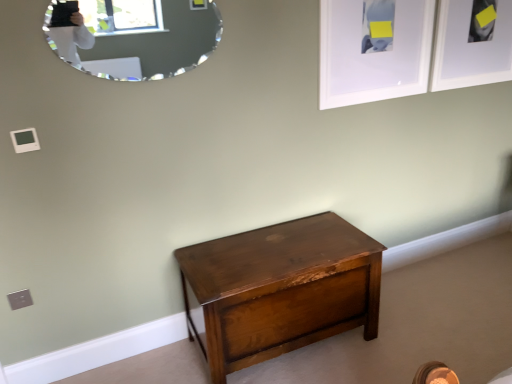
Question: Is white matte picture frame at upper right, the 1th picture frame positioned from the left, facing towards white matte picture frame at upper right, which appears as the 2th picture frame when viewed from the left?

Choices:
 (A) yes
 (B) no

Answer: (B)

Question: Can you confirm if white matte picture frame at upper right, the second picture frame when ordered from right to left, is positioned to the right of white matte picture frame at upper right, positioned as the first picture frame in right-to-left order?

Choices:
 (A) yes
 (B) no

Answer: (B)

Question: From a real-world perspective, is white matte picture frame at upper right, the second picture frame when ordered from right to left, over white matte picture frame at upper right, which appears as the 2th picture frame when viewed from the left?

Choices:
 (A) no
 (B) yes

Answer: (B)

Question: Is white matte picture frame at upper right, the second picture frame when ordered from right to left, thinner than white matte picture frame at upper right, which appears as the 2th picture frame when viewed from the left?

Choices:
 (A) yes
 (B) no

Answer: (A)

Question: Considering the relative sizes of white matte picture frame at upper right, the 1th picture frame positioned from the left, and white matte picture frame at upper right, which appears as the 2th picture frame when viewed from the left, in the image provided, is white matte picture frame at upper right, the 1th picture frame positioned from the left, taller than white matte picture frame at upper right, which appears as the 2th picture frame when viewed from the left,?

Choices:
 (A) yes
 (B) no

Answer: (A)

Question: From a real-world perspective, is silver-framed mirror at upper left above or below white matte picture frame at upper right, the second picture frame when ordered from right to left?

Choices:
 (A) above
 (B) below

Answer: (A)

Question: Is silver-framed mirror at upper left in front of or behind white matte picture frame at upper right, the 1th picture frame positioned from the left, in the image?

Choices:
 (A) behind
 (B) front

Answer: (B)

Question: Is point (138, 61) positioned closer to the camera than point (425, 74)?

Choices:
 (A) farther
 (B) closer

Answer: (B)

Question: Is silver-framed mirror at upper left inside the boundaries of white matte picture frame at upper right, the 1th picture frame positioned from the left, or outside?

Choices:
 (A) inside
 (B) outside

Answer: (B)

Question: Looking at the image, does shiny brown wood chest at center seem bigger or smaller compared to white matte picture frame at upper right, the second picture frame when ordered from right to left?

Choices:
 (A) big
 (B) small

Answer: (A)

Question: In the image, is shiny brown wood chest at center positioned in front of or behind white matte picture frame at upper right, the second picture frame when ordered from right to left?

Choices:
 (A) behind
 (B) front

Answer: (B)

Question: Is point (199, 259) closer or farther from the camera than point (424, 82)?

Choices:
 (A) closer
 (B) farther

Answer: (A)

Question: Based on their positions, is shiny brown wood chest at center located to the left or right of white matte picture frame at upper right, the 1th picture frame positioned from the left?

Choices:
 (A) left
 (B) right

Answer: (A)

Question: Is silver-framed mirror at upper left situated inside shiny brown wood chest at center or outside?

Choices:
 (A) outside
 (B) inside

Answer: (A)

Question: Is silver-framed mirror at upper left taller or shorter than shiny brown wood chest at center?

Choices:
 (A) short
 (B) tall

Answer: (A)